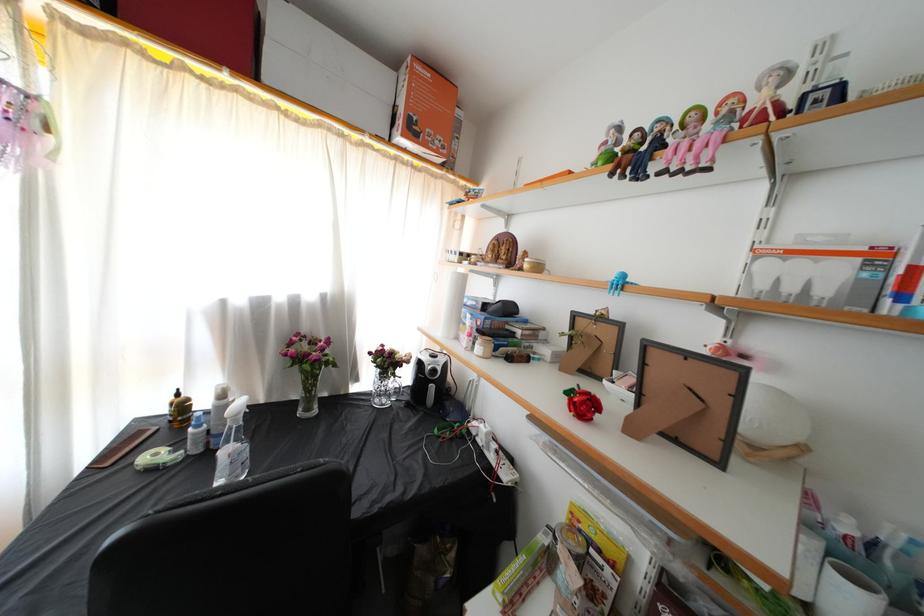
The height and width of the screenshot is (616, 924). I want to click on orange cardboard box, so [x=423, y=111].